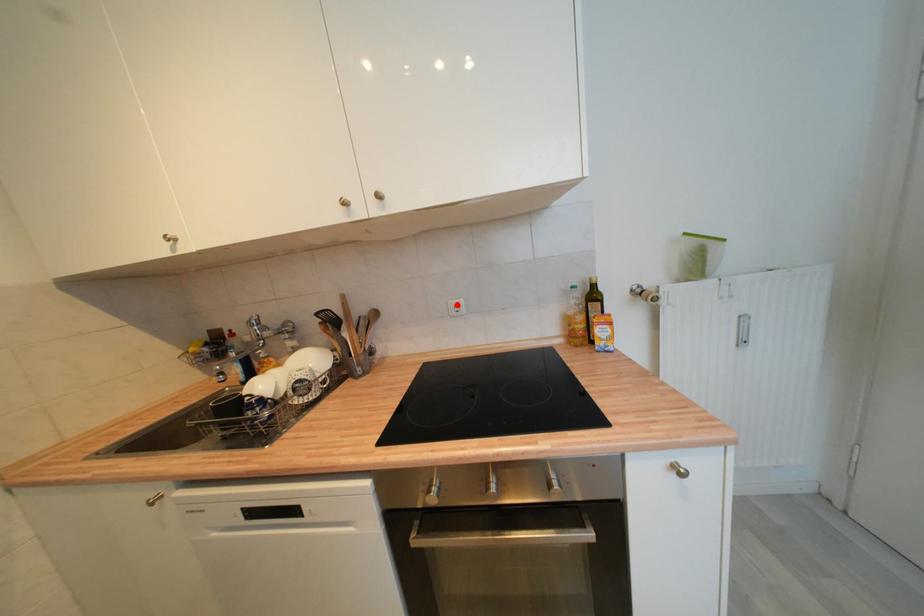
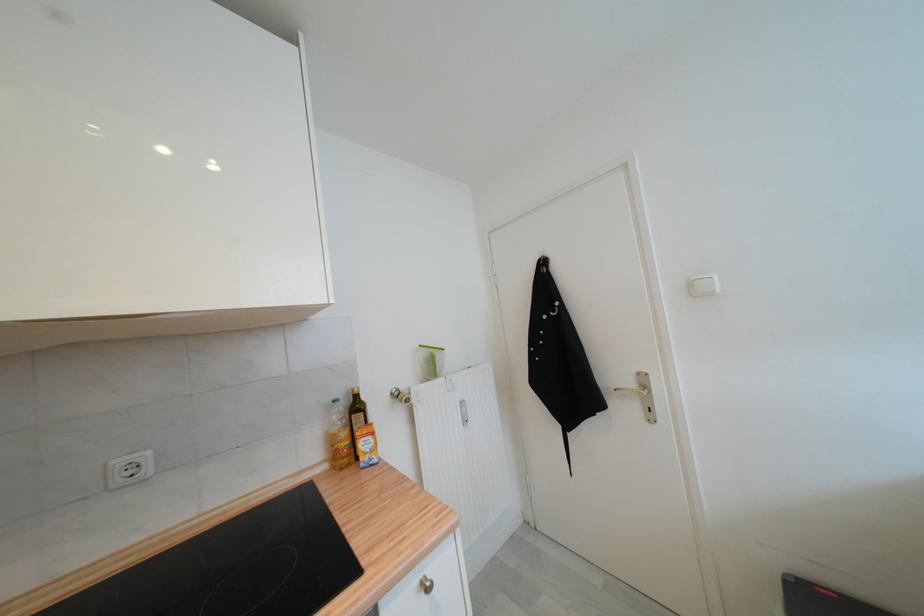
Find the pixel in the second image that matches the highlighted location in the first image.

(126, 464)